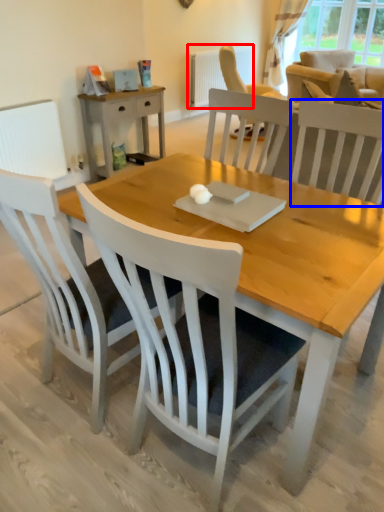
Question: Which object is further to the camera taking this photo, radiator (highlighted by a red box) or chair (highlighted by a blue box)?

Choices:
 (A) radiator
 (B) chair

Answer: (A)